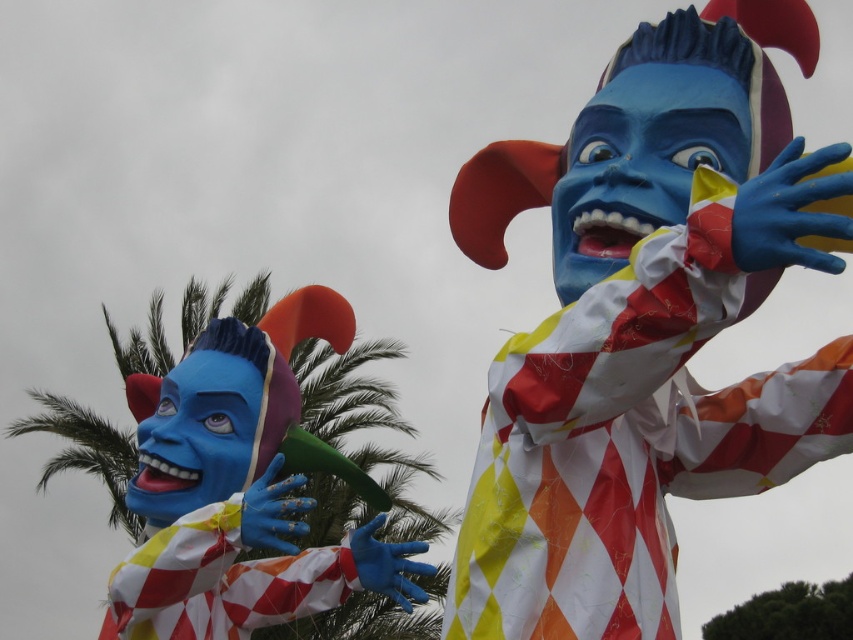
Question: Does harlequin costume at center have a greater width compared to matte paper clown at left?

Choices:
 (A) yes
 (B) no

Answer: (A)

Question: In this image, where is harlequin costume at center located relative to matte paper clown at left?

Choices:
 (A) right
 (B) left

Answer: (A)

Question: Can you confirm if harlequin costume at center is smaller than matte paper clown at left?

Choices:
 (A) yes
 (B) no

Answer: (B)

Question: Which of the following is the closest to the observer?

Choices:
 (A) matte paper clown at left
 (B) harlequin costume at center

Answer: (B)